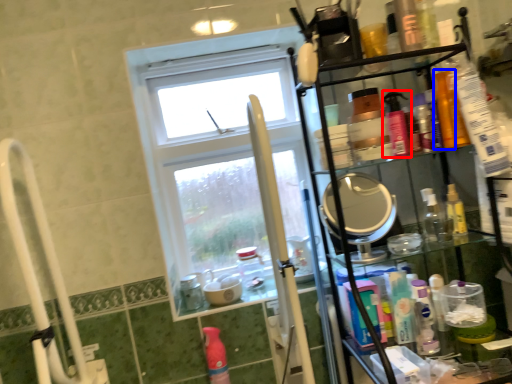
Question: Which object appears closest to the camera in this image, mouthwash (highlighted by a red box) or mouthwash (highlighted by a blue box)?

Choices:
 (A) mouthwash
 (B) mouthwash

Answer: (A)